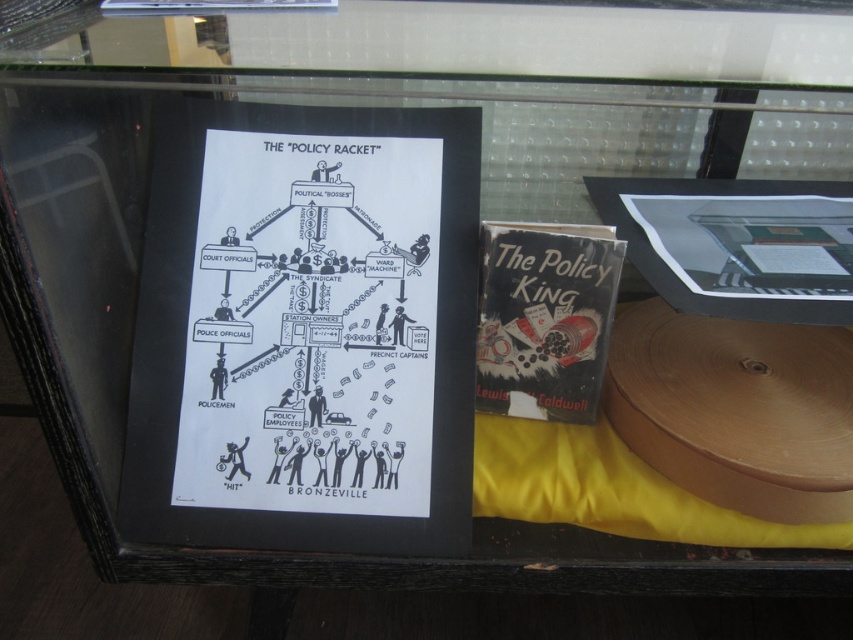
Question: Which point appears farthest from the camera in this image?

Choices:
 (A) (766, 180)
 (B) (561, 371)

Answer: (A)

Question: Observing the image, what is the correct spatial positioning of black paper poster at center in reference to black paperback book at center?

Choices:
 (A) below
 (B) above

Answer: (B)

Question: Does black paper poster at center appear on the right side of hardcover book at upper right?

Choices:
 (A) no
 (B) yes

Answer: (A)

Question: Which point is farther from the camera taking this photo?

Choices:
 (A) (732, 240)
 (B) (605, 344)

Answer: (A)

Question: Which object is the farthest from the black paperback book at center?

Choices:
 (A) hardcover book at upper right
 (B) black paper poster at center

Answer: (A)

Question: Is hardcover book at upper right above black paperback book at center?

Choices:
 (A) no
 (B) yes

Answer: (B)